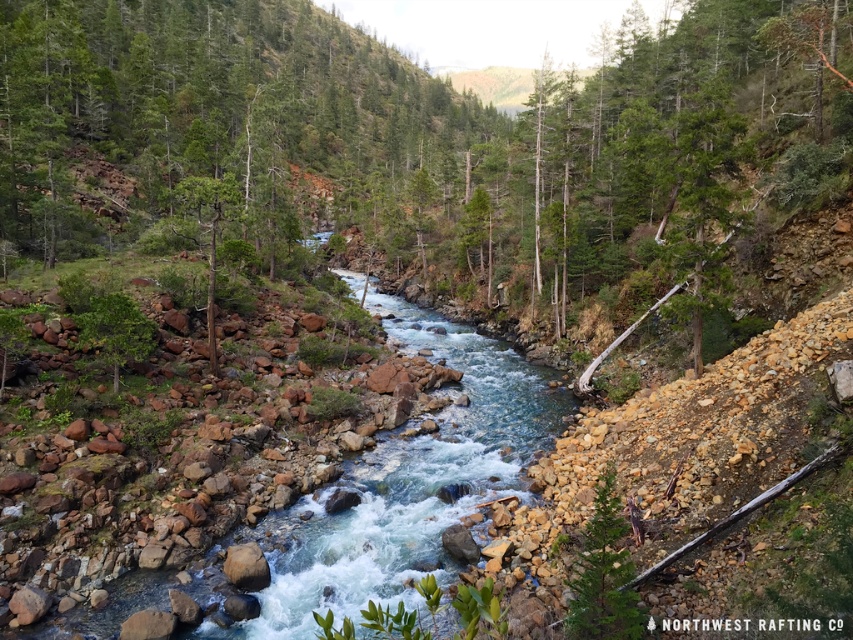
Can you confirm if green matte tree at lower right is positioned to the left of green rough bark tree at center-left?

In fact, green matte tree at lower right is to the right of green rough bark tree at center-left.

Between point (569, 621) and point (175, 198), which one is positioned behind?

Point (175, 198)

Where is `green matte tree at lower right`? This screenshot has width=853, height=640. green matte tree at lower right is located at coordinates (602, 577).